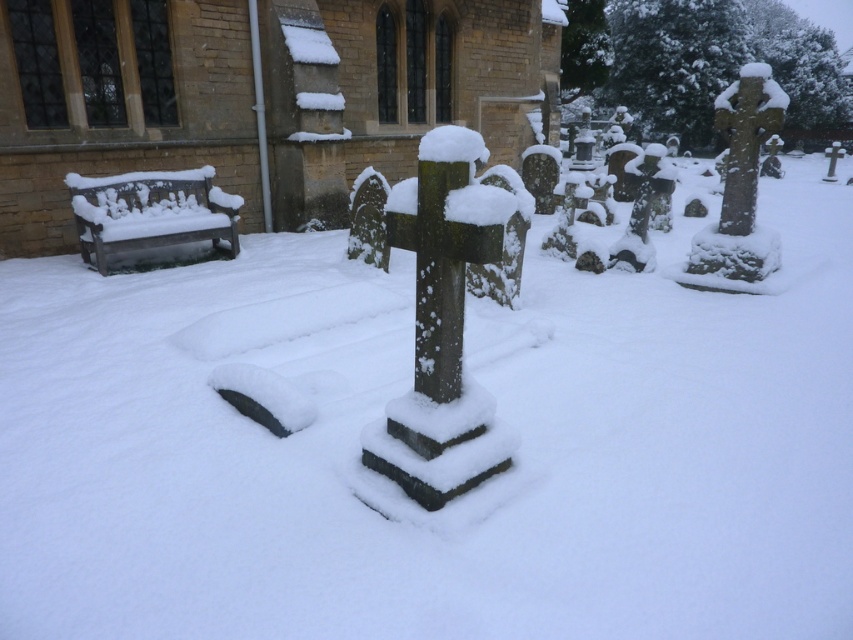
Is brick textured church at left above green mossy stone cross at center?

Indeed, brick textured church at left is positioned over green mossy stone cross at center.

Does point (531, 10) come in front of point (439, 228)?

No, it is not.

Find the location of a particular element. Image resolution: width=853 pixels, height=640 pixels. brick textured church at left is located at coordinates (254, 96).